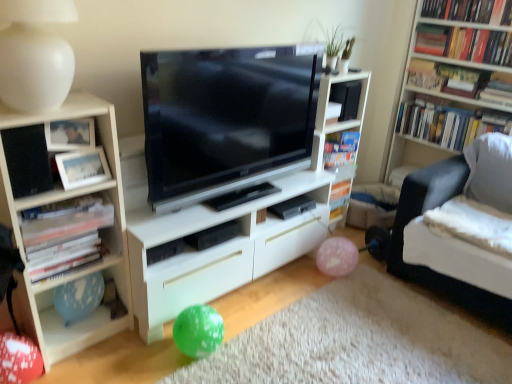
Locate an element on the screen. free point to the left of pink dotted balloon at lower right, positioned as the second balloon in left-to-right order is located at coordinates (304, 269).